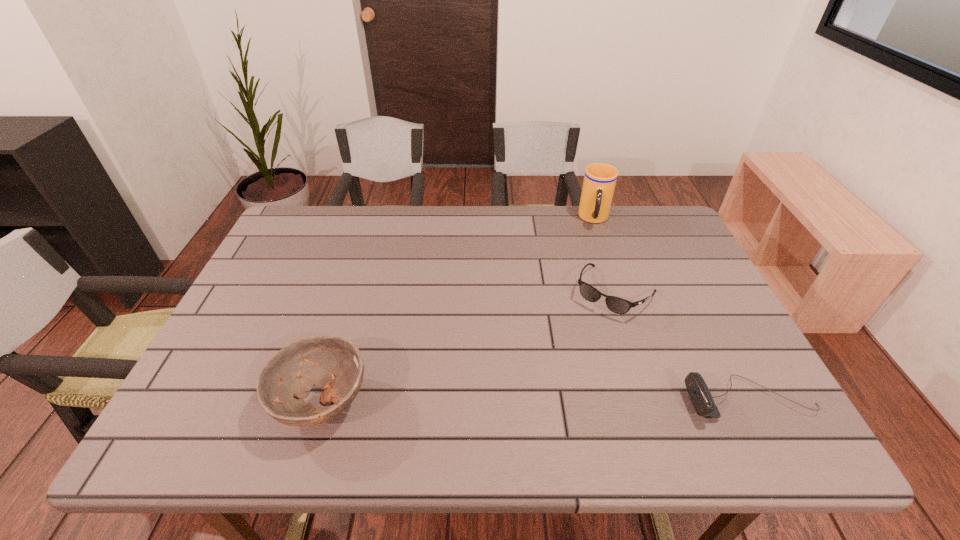
In order to click on free space on the desktop that is between the third shortest object and the webcam and is positioned on the side of the tallest object with the handle in this screenshot , I will do (595, 401).

Locate an element on the screen. The image size is (960, 540). vacant space on the desktop that is between the bowl and the webcam and is positioned on the front-facing side of the second farthest object is located at coordinates [x=539, y=401].